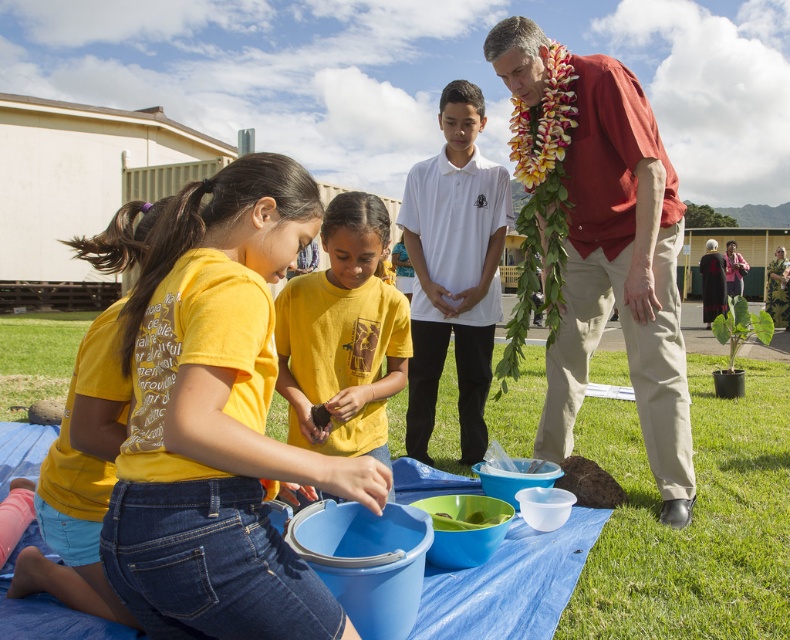
Question: Estimate the real-world distances between objects in this image. Which object is closer to the green leafy plant at lower right?

Choices:
 (A) yellow cotton shirt at center
 (B) yellow cotton shirt at lower left
 (C) red cotton shirt at upper right
 (D) green leafy plant at lower left

Answer: (C)

Question: Can you confirm if yellow cotton shirt at center is bigger than green leafy plant at lower left?

Choices:
 (A) no
 (B) yes

Answer: (A)

Question: Does yellow cotton shirt at center come in front of green leafy plant at lower left?

Choices:
 (A) no
 (B) yes

Answer: (B)

Question: Which point is closer to the camera?

Choices:
 (A) (743, 301)
 (B) (363, 220)

Answer: (B)

Question: Can you confirm if yellow cotton shirt at lower left is wider than green leafy plant at lower left?

Choices:
 (A) no
 (B) yes

Answer: (A)

Question: Which object appears closest to the camera in this image?

Choices:
 (A) yellow matte shirt at center
 (B) red cotton shirt at upper right
 (C) yellow cotton shirt at lower left
 (D) green leafy plant at lower left

Answer: (C)